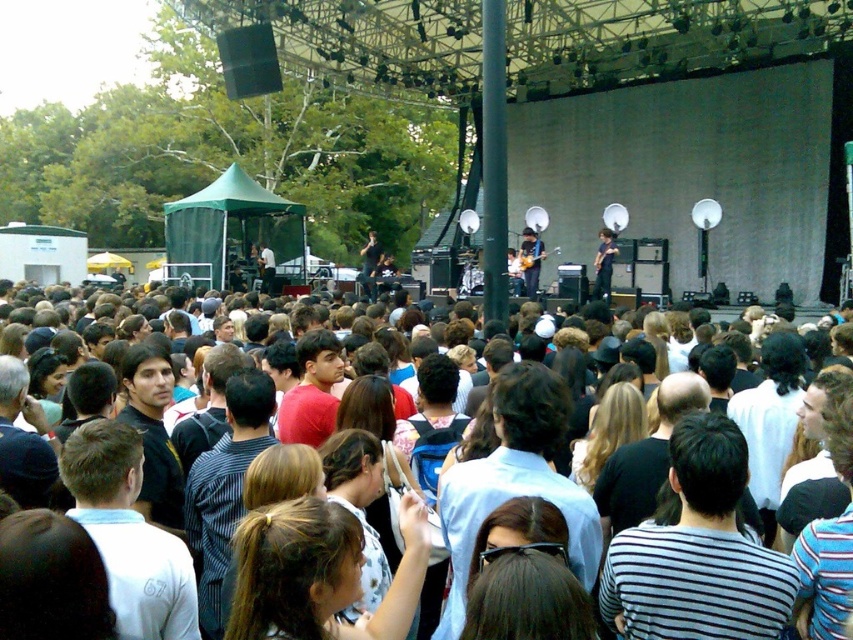
Question: Which object is the farthest from the dark gray shirt at center?

Choices:
 (A) white cotton shirt at lower left
 (B) striped shirt at center
 (C) red matte shirt at center
 (D) light blue shirt at center

Answer: (D)

Question: Which point appears closest to the camera in this image?

Choices:
 (A) (328, 413)
 (B) (21, 499)

Answer: (B)

Question: Is brown hair at center above light blue shirt at center?

Choices:
 (A) yes
 (B) no

Answer: (B)

Question: Is brown hair at center bigger than red matte shirt at center?

Choices:
 (A) no
 (B) yes

Answer: (A)

Question: Is striped cotton shirt at center positioned behind brown hair at center?

Choices:
 (A) yes
 (B) no

Answer: (B)

Question: Which point is closer to the camera taking this photo?

Choices:
 (A) (833, 506)
 (B) (305, 392)
 (C) (148, 358)

Answer: (A)